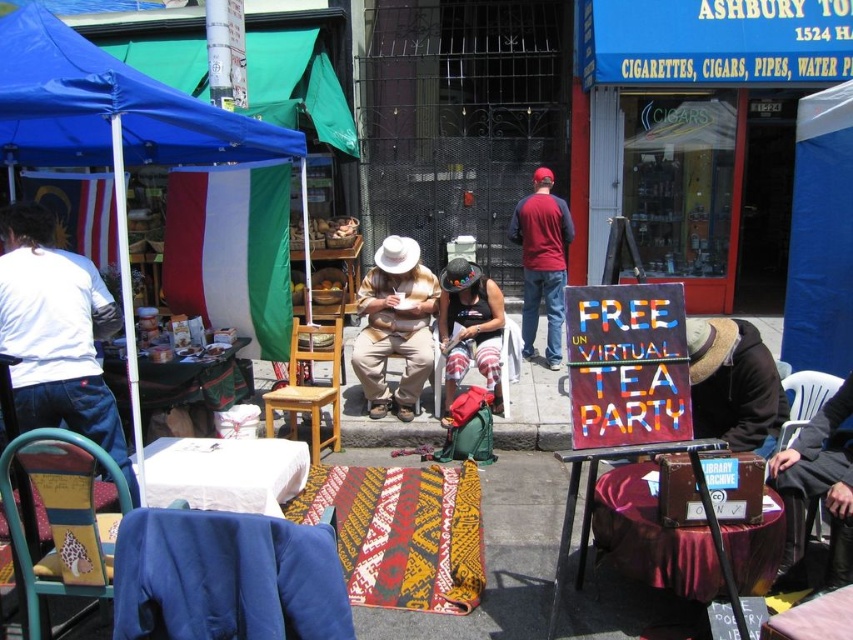
You are a customer at the market and want to sit down. You see the blue fabric chair at lower left and the white fabric table at lower left. Which one is on the right side of the other?

The blue fabric chair at lower left is positioned on the right side of white fabric table at lower left.

You are a customer at the market and want to buy a maroon cotton shirt at center. The vendor is under the blue fabric canopy at upper left. To get to the shirt, do you need to walk under the canopy?

The blue fabric canopy at upper left is above the maroon cotton shirt at center, so the shirt is located under the canopy. Therefore, you need to walk under the canopy to reach the maroon cotton shirt at center.

You are a customer at the market and want to buy a maroon cotton shirt at center. The vendor is under the blue fabric canopy at upper left. Which direction should you walk from the canopy to reach the shirt?

The blue fabric canopy at upper left is to the left of the maroon cotton shirt at center, so you should walk to the right to reach the shirt from the canopy.